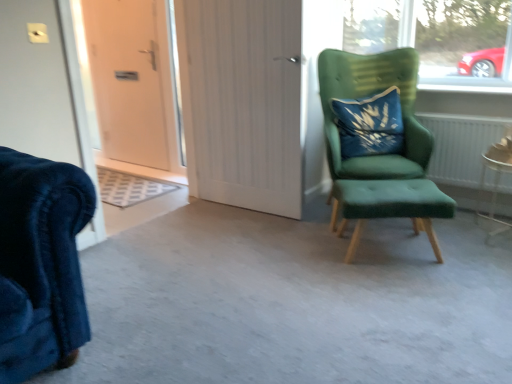
The width and height of the screenshot is (512, 384). Identify the location of vacant area situated below green fabric stool at right (from a real-world perspective). (393, 240).